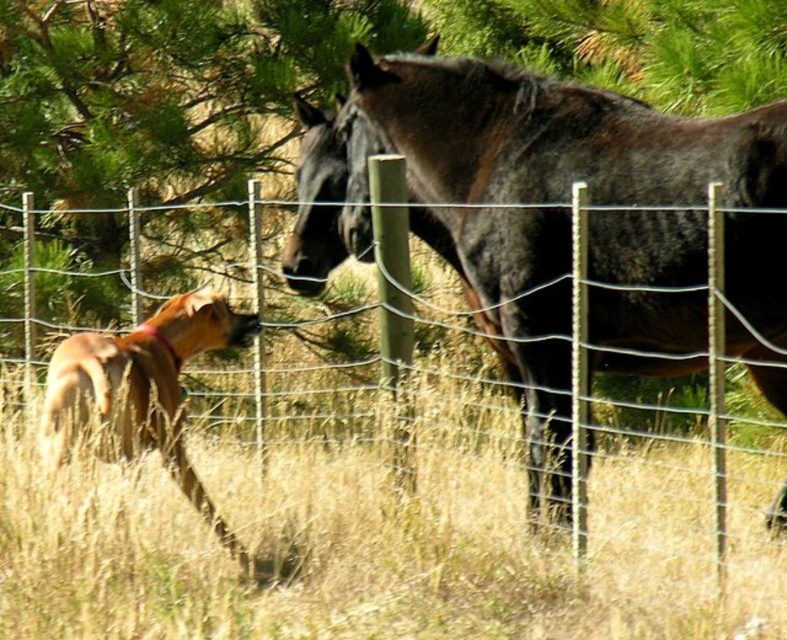
What is located at the coordinates point (560, 224) in the image?

The dark brown glossy horse at center is located at point (560, 224).

You are a photographer trying to capture the dark brown glossy horse at center and the dry grass at lower left in the same frame. Based on their positions, which one should you focus on first to ensure both are in focus?

The dry grass at lower left is located below the dark brown glossy horse at center, so you should focus on the dark brown glossy horse at center first to ensure both are in focus since it is closer to the camera.

You are a farmer who needs to check the distance between the dry grass at lower left and the dark brown glossy horse at center to ensure the fence is secure. Can you confirm if the distance is more than 30 inches?

The distance between the dry grass at lower left and the dark brown glossy horse at center is 31.75 inches, which is more than 30 inches. Therefore, the fence is secure.